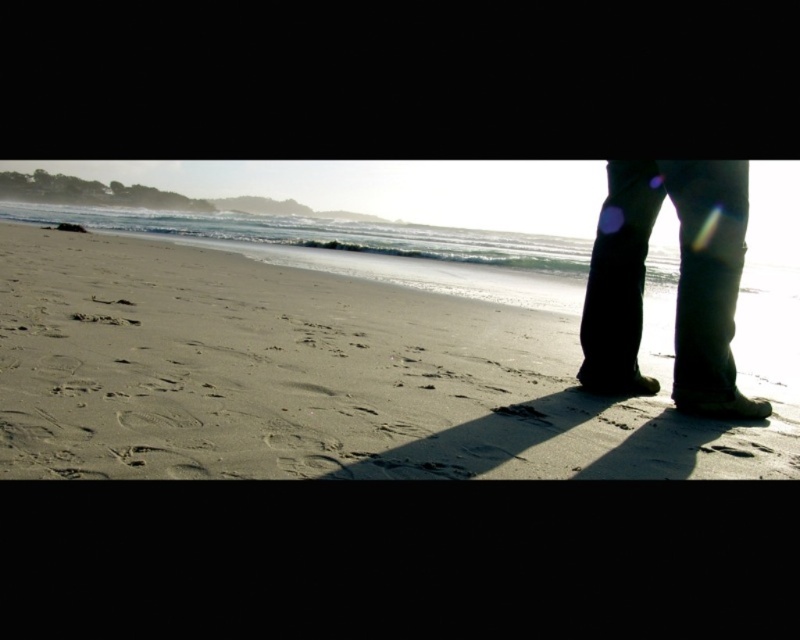
Measure the distance from sandy beach at lower center to dark denim pants at lower right.

sandy beach at lower center and dark denim pants at lower right are 58.28 centimeters apart.

Is sandy beach at lower center positioned behind dark denim pants at lower right?

No, it is not.

Where is `sandy beach at lower center`? sandy beach at lower center is located at coordinates (310, 378).